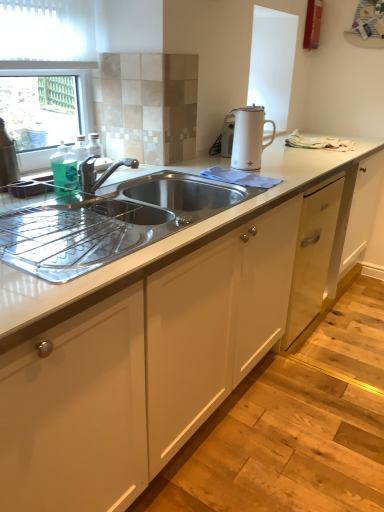
Question: Considering their positions, is stainless steel sink at center located in front of or behind white glossy electric kettle at upper right?

Choices:
 (A) front
 (B) behind

Answer: (A)

Question: Looking at the image, does stainless steel sink at center seem bigger or smaller compared to white glossy electric kettle at upper right?

Choices:
 (A) small
 (B) big

Answer: (B)

Question: From the image's perspective, relative to white glossy electric kettle at upper right, is stainless steel sink at center above or below?

Choices:
 (A) above
 (B) below

Answer: (B)

Question: In terms of width, does white glossy electric kettle at upper right look wider or thinner when compared to stainless steel sink at center?

Choices:
 (A) wide
 (B) thin

Answer: (B)

Question: From the image's perspective, is white glossy electric kettle at upper right above or below stainless steel sink at center?

Choices:
 (A) below
 (B) above

Answer: (B)

Question: From a real-world perspective, relative to stainless steel sink at center, is white glossy electric kettle at upper right vertically above or below?

Choices:
 (A) below
 (B) above

Answer: (B)

Question: Is white glossy electric kettle at upper right to the left or to the right of stainless steel sink at center in the image?

Choices:
 (A) left
 (B) right

Answer: (B)